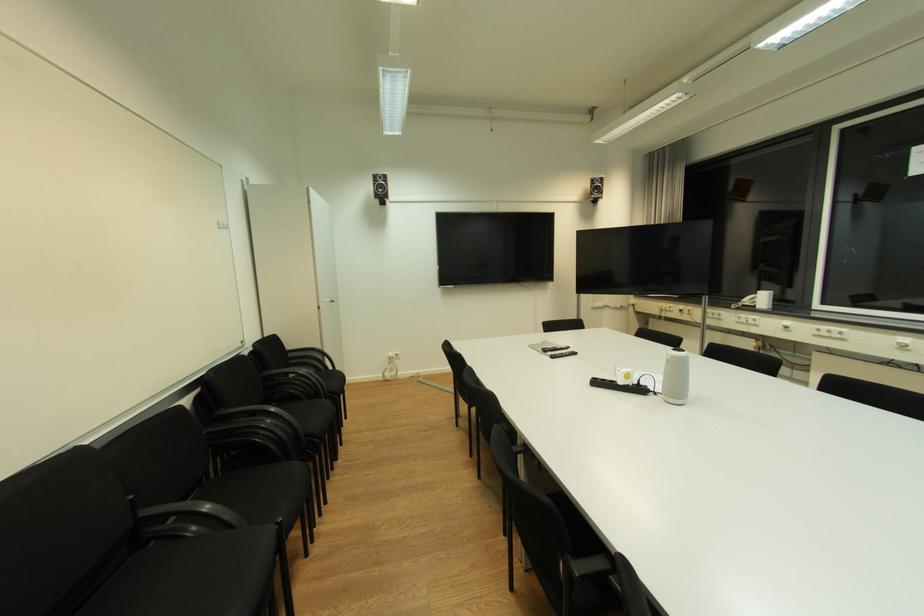
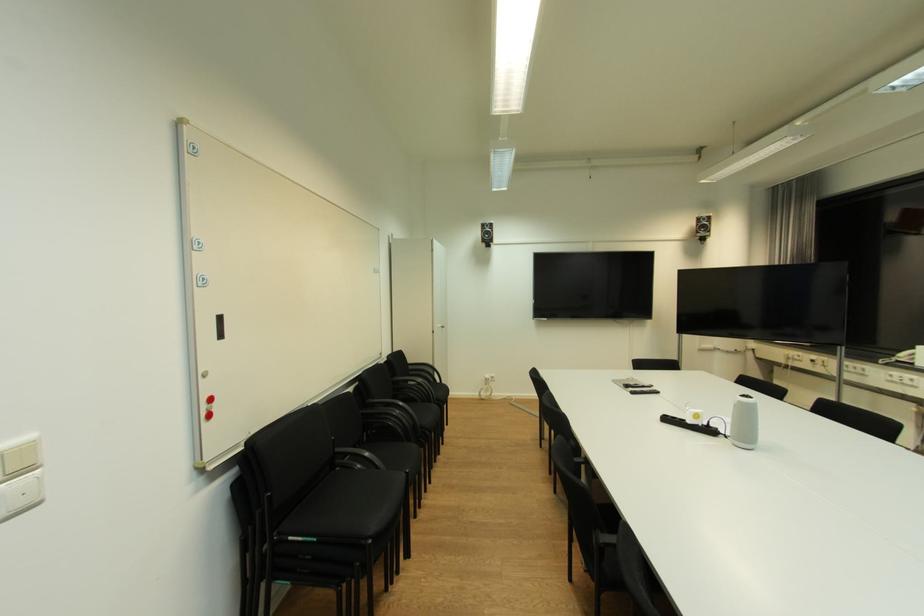
In the second image, find the point that corresponds to (x=602, y=384) in the first image.

(674, 421)